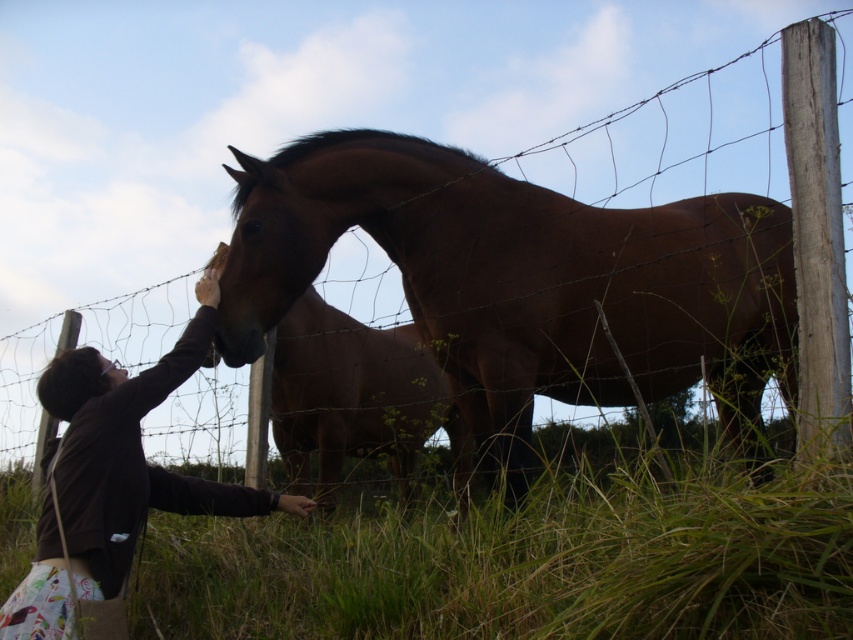
You are a child trying to reach the horse behind the fence. You are standing on the green grass at lower center and wearing the dark brown sweater at left. Can you stretch your hand to touch the horse if your arm is 24 inches long?

The distance between the green grass at lower center and dark brown sweater at left is 28.32 inches. Since your arm is only 24 inches long, you cannot reach the horse as your arm is shorter than the required distance.

You are a photographer trying to capture the scene with the green grass at lower center and the dark brown sweater at left. Which object should you focus on first if you want to ensure both are in focus?

The dark brown sweater at left should be focused on first because it is closer to the photographer than the green grass at lower center, which is further away.

You are a photographer trying to capture the scene with the green grass at lower center and the dark brown sweater at left. Which object would occupy more space in your photo?

The green grass at lower center occupies more space in the photo because it is larger in size than the dark brown sweater at left.